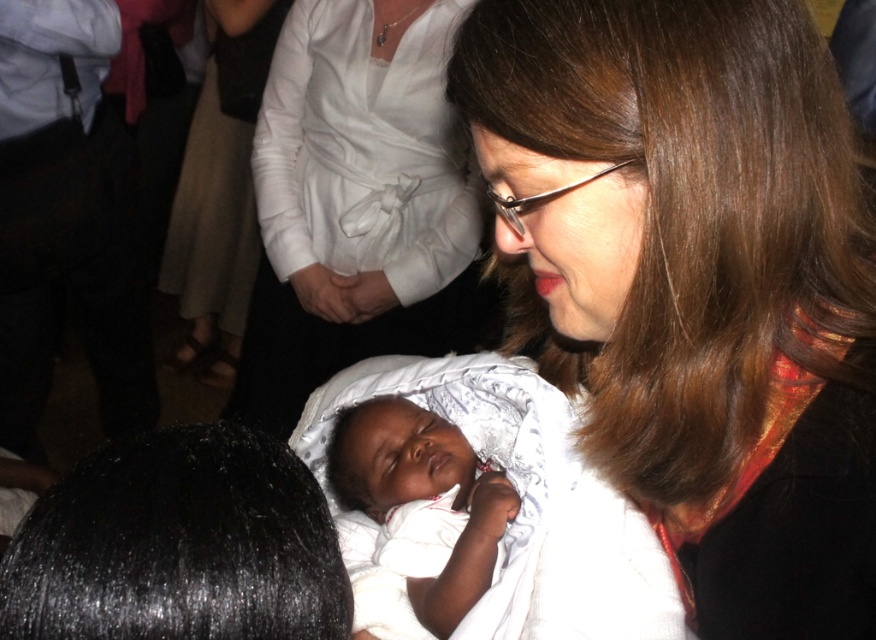
Question: Which object appears farthest from the camera in this image?

Choices:
 (A) white soft cloth at center
 (B) smooth brown hair at center
 (C) white satin dress at center

Answer: (C)

Question: Can you confirm if smooth brown hair at center is wider than white satin dress at center?

Choices:
 (A) yes
 (B) no

Answer: (B)

Question: Which point is closer to the camera?

Choices:
 (A) (426, 420)
 (B) (401, 108)

Answer: (A)

Question: Can you confirm if smooth brown hair at center is positioned to the left of white soft cloth at center?

Choices:
 (A) yes
 (B) no

Answer: (B)

Question: Which is nearer to the smooth brown hair at center?

Choices:
 (A) white soft cloth at center
 (B) white satin dress at center

Answer: (A)

Question: Can you confirm if white satin dress at center is thinner than white soft cloth at center?

Choices:
 (A) yes
 (B) no

Answer: (B)